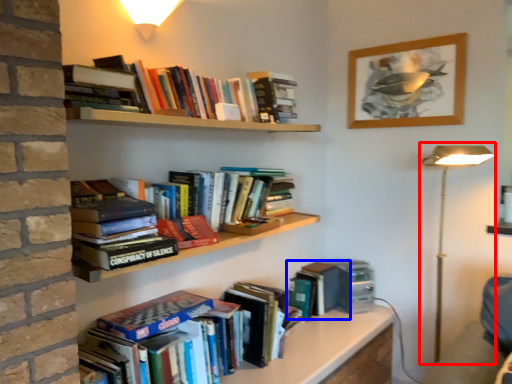
Question: Which point is closer to the camera, table lamp (highlighted by a red box) or book (highlighted by a blue box)?

Choices:
 (A) table lamp
 (B) book

Answer: (A)